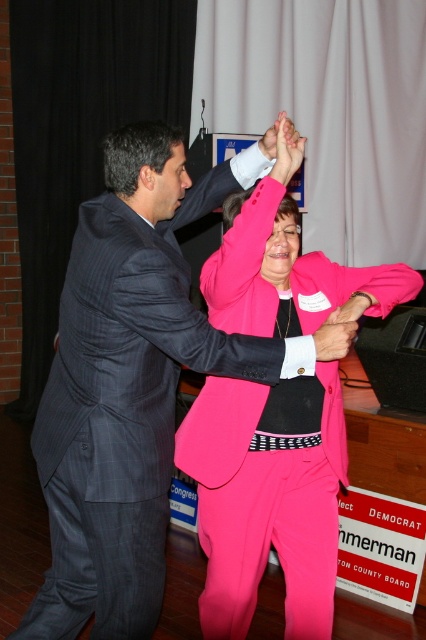
Find the location of `pink matte suit at center`. pink matte suit at center is located at coordinates (267, 497).

Can you confirm if pink matte suit at center is positioned to the right of pink fabric hand at upper center?

Correct, you'll find pink matte suit at center to the right of pink fabric hand at upper center.

Is point (276, 403) behind point (273, 131)?

Yes, it is.

Locate an element on the screen. This screenshot has width=426, height=640. pink matte suit at center is located at coordinates [267, 497].

How much distance is there between pink matte suit at center and matte pink sleeve at upper center?

pink matte suit at center and matte pink sleeve at upper center are 13.60 inches apart.

Between point (353, 288) and point (339, 307), which one is positioned behind?

The point (353, 288) is behind.

Locate an element on the screen. This screenshot has height=640, width=426. pink matte suit at center is located at coordinates (267, 497).

Between point (114, 426) and point (356, 324), which one is positioned behind?

The point (356, 324) is more distant.

Image resolution: width=426 pixels, height=640 pixels. What do you see at coordinates (129, 385) in the screenshot? I see `dark gray pinstripe suit at center` at bounding box center [129, 385].

Find the location of a particular element. The width and height of the screenshot is (426, 640). dark gray pinstripe suit at center is located at coordinates (129, 385).